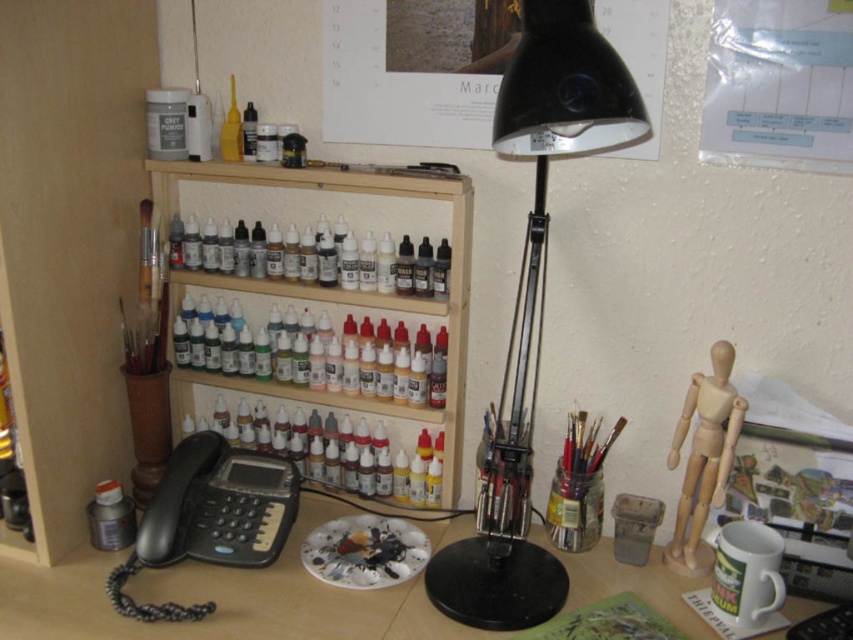
You are an artist who needs to place a new sculpture that is 1.2 meters tall on your desk. Given the wooden shelf at center and the black plastic phone at lower left, which object can accommodate the sculpture in terms of height?

The wooden shelf at center can accommodate the sculpture since it is bigger than the black plastic phone at lower left, implying it has sufficient height.

You are an artist who needs to place a new canvas on the desk. The canvas is 2 meters tall. Can you fit it vertically on the wooden desk at center without it overlapping with the wooden shelf at center?

The wooden desk at center is in front of the wooden shelf at center, meaning the desk is closer to you than the shelf. Since the canvas is placed vertically on the desk, it won t interfere with the shelf behind it, so yes, it can be placed there.